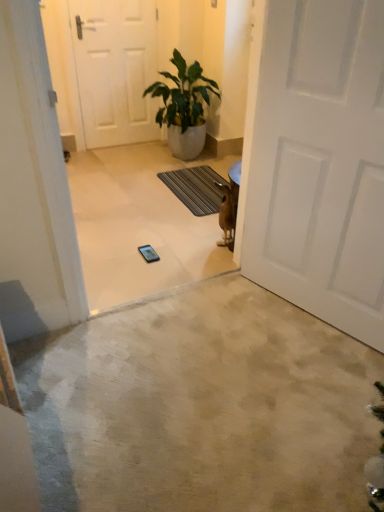
Identify the location of free space in front of white matte door at center, which is the first door from bottom to top. (301, 378).